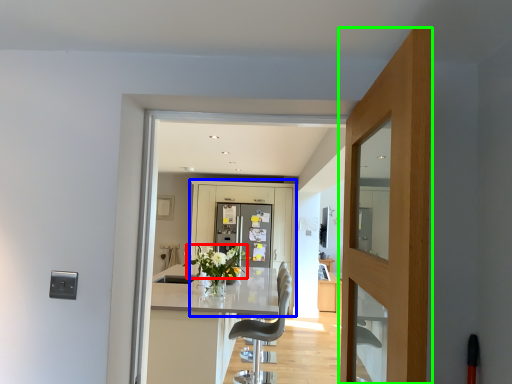
Question: Considering the real-world distances, which object is farthest from flower (highlighted by a red box)? barn door (highlighted by a blue box) or door (highlighted by a green box)?

Choices:
 (A) barn door
 (B) door

Answer: (B)